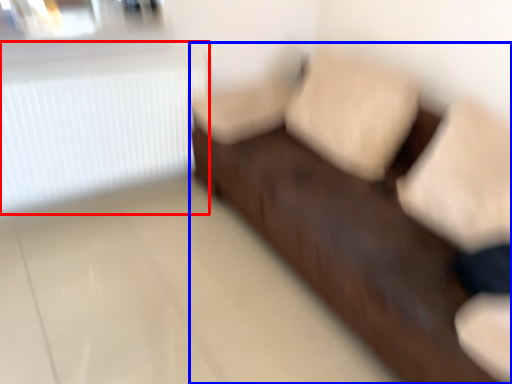
Question: Which object is further to the camera taking this photo, radiator (highlighted by a red box) or furniture (highlighted by a blue box)?

Choices:
 (A) radiator
 (B) furniture

Answer: (A)